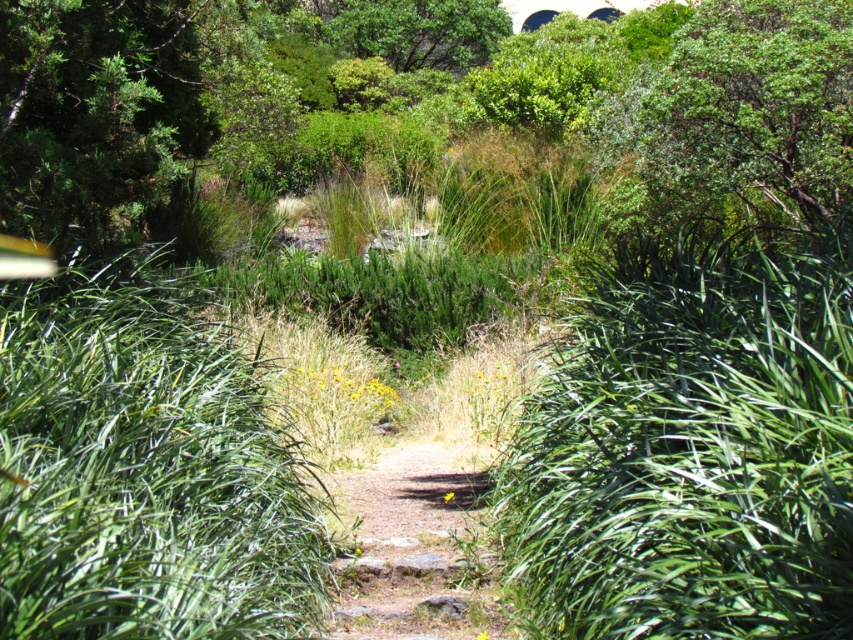
Question: Is green leafy tree at upper right thinner than dirt path at center?

Choices:
 (A) yes
 (B) no

Answer: (B)

Question: Can you confirm if green leafy tree at upper right is wider than dirt path at center?

Choices:
 (A) yes
 (B) no

Answer: (A)

Question: Is green leafy bush at center to the left of dirt path at center from the viewer's perspective?

Choices:
 (A) yes
 (B) no

Answer: (B)

Question: Which point is farther to the camera?

Choices:
 (A) green leafy tree at upper right
 (B) dirt path at center
 (C) green leafy bush at center

Answer: (A)

Question: Which is nearer to the dirt path at center?

Choices:
 (A) green leafy bush at center
 (B) green leafy tree at upper right

Answer: (A)

Question: Which object is positioned closest to the green leafy bush at center?

Choices:
 (A) green leafy tree at upper right
 (B) dirt path at center

Answer: (B)